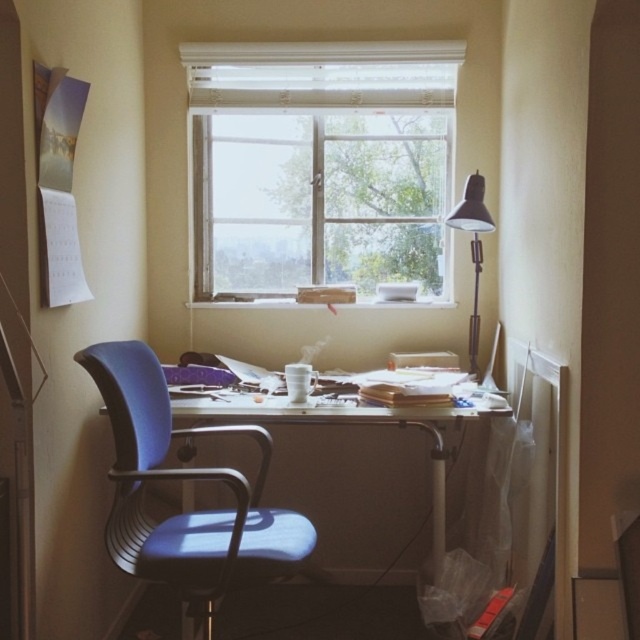
Question: Can you confirm if blue fabric swivel chair at left is positioned to the right of blue fabric computer desk at center?

Choices:
 (A) yes
 (B) no

Answer: (B)

Question: Which object is the farthest from the white textured window at upper center?

Choices:
 (A) metallic gray floor lamp at right
 (B) blue fabric swivel chair at left

Answer: (B)

Question: Which point is farther from the camera taking this photo?

Choices:
 (A) (429, 451)
 (B) (227, 248)
 (C) (476, 189)
 (D) (124, 460)

Answer: (B)

Question: Is blue fabric swivel chair at left positioned in front of metallic gray floor lamp at right?

Choices:
 (A) yes
 (B) no

Answer: (A)

Question: Can you confirm if blue fabric swivel chair at left is positioned below metallic gray floor lamp at right?

Choices:
 (A) no
 (B) yes

Answer: (B)

Question: Which object appears farthest from the camera in this image?

Choices:
 (A) white textured window at upper center
 (B) metallic gray floor lamp at right

Answer: (A)